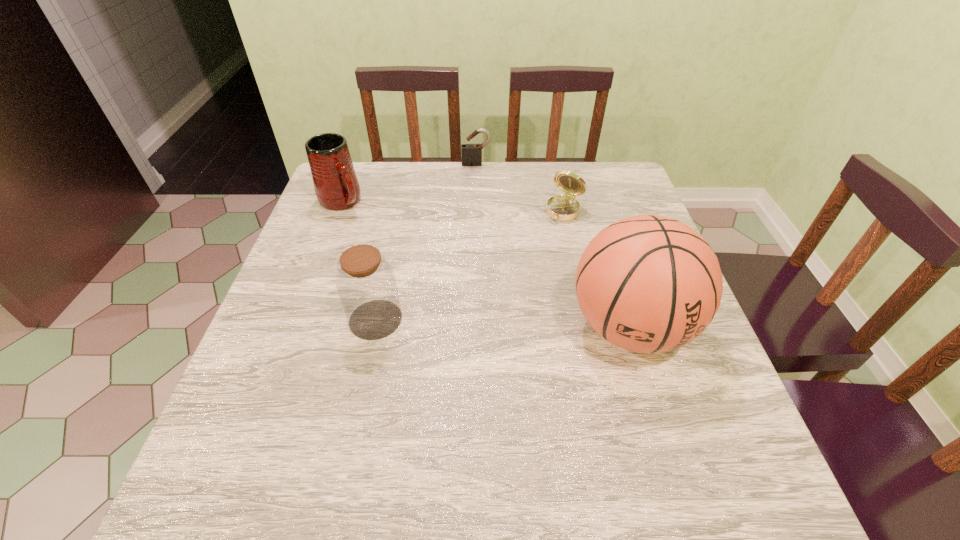
At what (x,y) coordinates should I click in order to perform the action: click on jar. Please return your answer as a coordinate pair (x, y). Looking at the image, I should click on (366, 284).

The width and height of the screenshot is (960, 540). What are the coordinates of `basketball` in the screenshot? It's located at 649,284.

Locate an element on the screen. The image size is (960, 540). compass is located at coordinates (563, 208).

The width and height of the screenshot is (960, 540). Identify the location of the farthest object. pyautogui.click(x=471, y=154).

Find the location of `padlock`. padlock is located at coordinates (471, 154).

Identify the location of mug. (336, 185).

This screenshot has width=960, height=540. Identify the location of free point located on the left of the second object from left to right. (321, 319).

Find the location of a particular element. free spot located 0.080m on the surface of the tallest object near the brand logo is located at coordinates (658, 421).

Find the location of a particular element. The width and height of the screenshot is (960, 540). vacant region located 0.120m with the dial facing the compass is located at coordinates (538, 248).

This screenshot has height=540, width=960. I want to click on blank area located with the dial facing the compass, so click(488, 315).